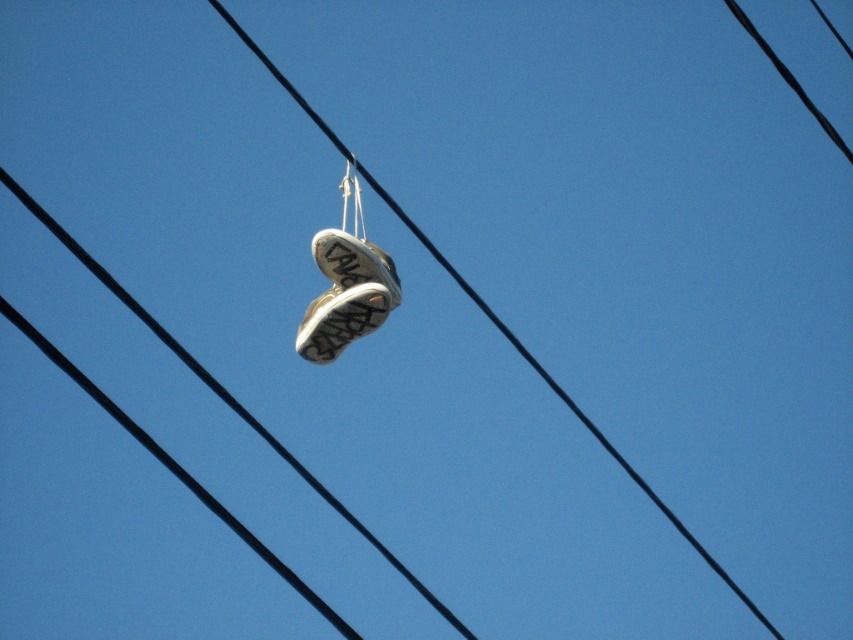
Who is shorter, white leather sneakers at center or black rubber shoe at center?

white leather sneakers at center is shorter.

This screenshot has width=853, height=640. I want to click on white leather sneakers at center, so 346,294.

Can you confirm if black rubber shoe at center is positioned below white fabric shoe at center?

Actually, black rubber shoe at center is above white fabric shoe at center.

Between black rubber shoe at center and white fabric shoe at center, which one appears on the right side from the viewer's perspective?

black rubber shoe at center

Describe the element at coordinates (492, 316) in the screenshot. I see `black rubber shoe at center` at that location.

I want to click on black rubber shoe at center, so click(492, 316).

This screenshot has width=853, height=640. Identify the location of white leather sneakers at center. (346, 294).

Who is positioned more to the right, white leather sneakers at center or white fabric shoe at center?

Answer: From the viewer's perspective, white leather sneakers at center appears more on the right side.

Image resolution: width=853 pixels, height=640 pixels. Describe the element at coordinates (346, 294) in the screenshot. I see `white leather sneakers at center` at that location.

Find the location of a particular element. The width and height of the screenshot is (853, 640). white leather sneakers at center is located at coordinates pos(346,294).